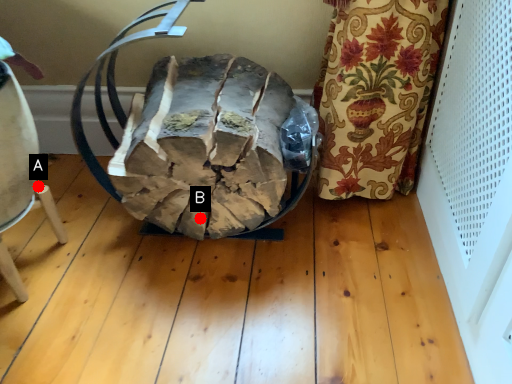
Question: Two points are circled on the image, labeled by A and B beside each circle. Which point is closer to the camera taking this photo?

Choices:
 (A) A is closer
 (B) B is closer

Answer: (A)